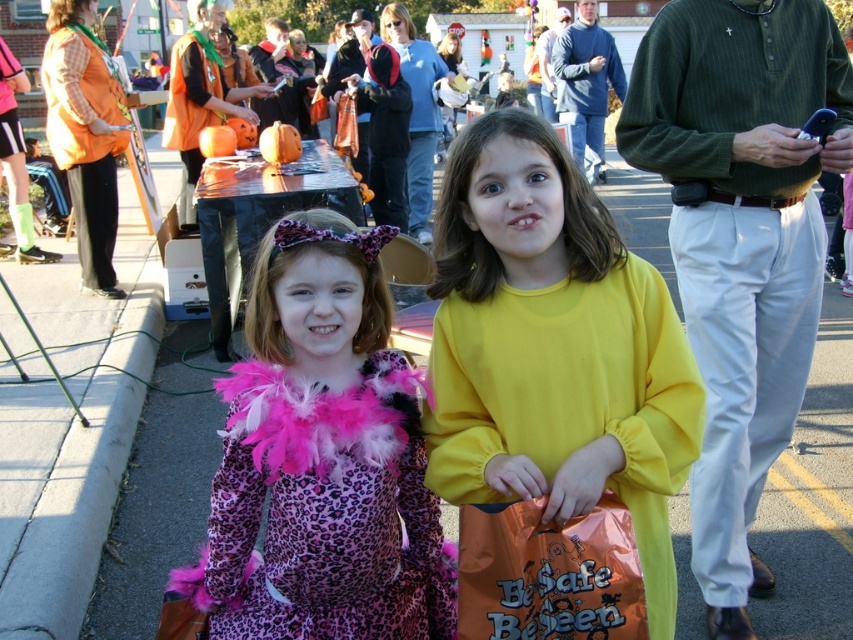
You are a photographer trying to capture a closeup of the orange plastic bag at lower center and the green textured sweater at upper right. Which object should you zoom in on to ensure both fit in the frame without distortion?

The orange plastic bag at lower center has a lesser width compared to green textured sweater at upper right, so you should zoom in on the green textured sweater at upper right to accommodate its larger size.

You are a photographer setting up for a Halloween event. You have two subjects in front of you, the purple leopard print dress at center and the green textured sweater at upper right. Based on their positions and sizes in the image, which one appears shorter?

The purple leopard print dress at center appears shorter than the green textured sweater at upper right because it has a lesser height compared to it.